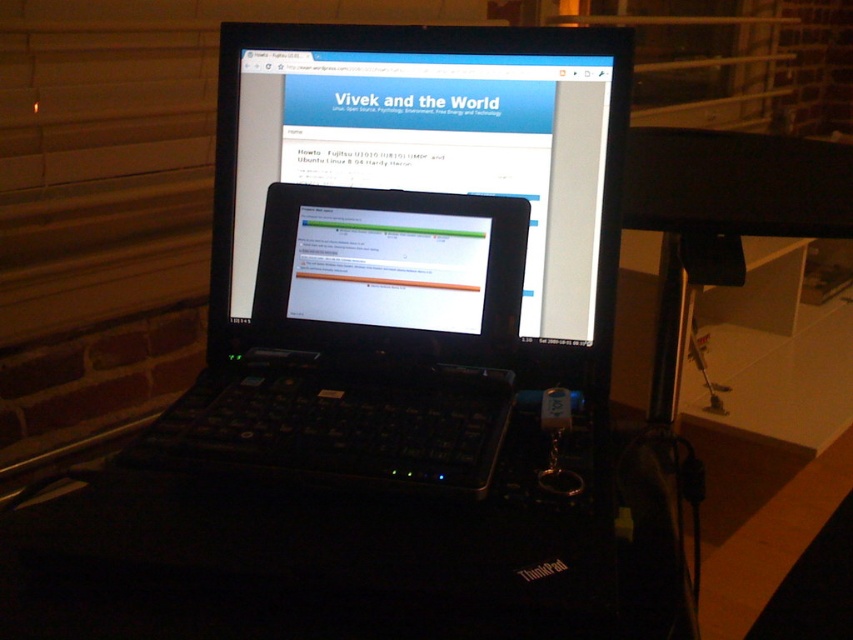
Question: Among these objects, which one is nearest to the camera?

Choices:
 (A) black plastic laptop at center
 (B) matte black laptop at center

Answer: (A)

Question: Observing the image, what is the correct spatial positioning of black plastic laptop at center in reference to matte black laptop at center?

Choices:
 (A) right
 (B) left

Answer: (B)

Question: Does black plastic laptop at center appear over matte black laptop at center?

Choices:
 (A) yes
 (B) no

Answer: (B)

Question: Which point appears farthest from the camera in this image?

Choices:
 (A) (451, 131)
 (B) (344, 86)

Answer: (B)

Question: Does black plastic laptop at center appear on the left side of matte black laptop at center?

Choices:
 (A) no
 (B) yes

Answer: (B)